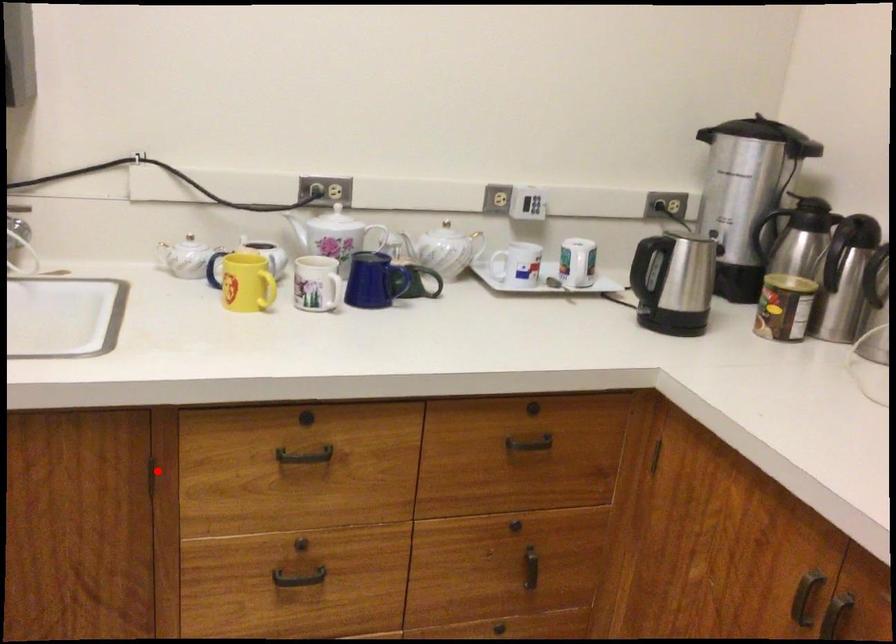
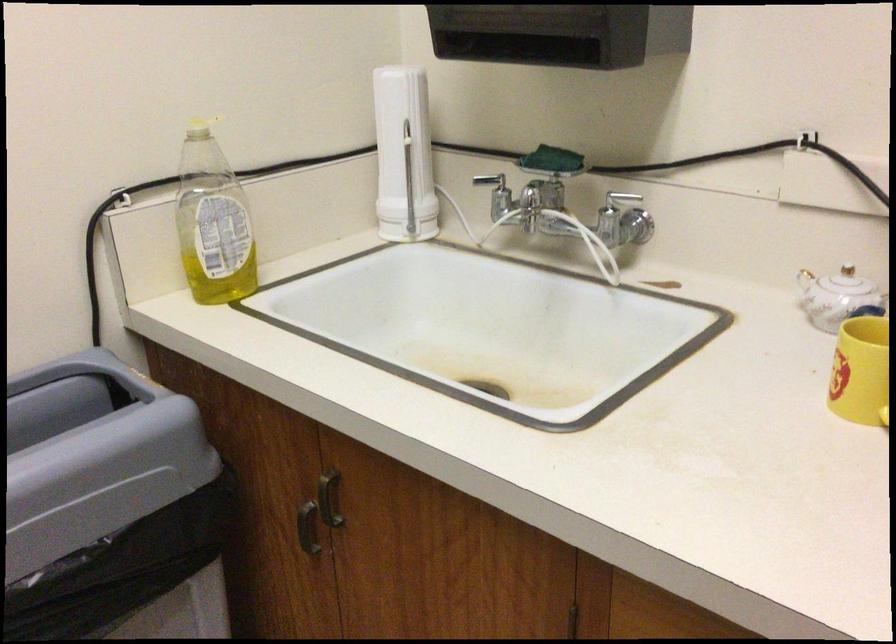
In the second image, find the point that corresponds to the highlighted location in the first image.

(576, 623)